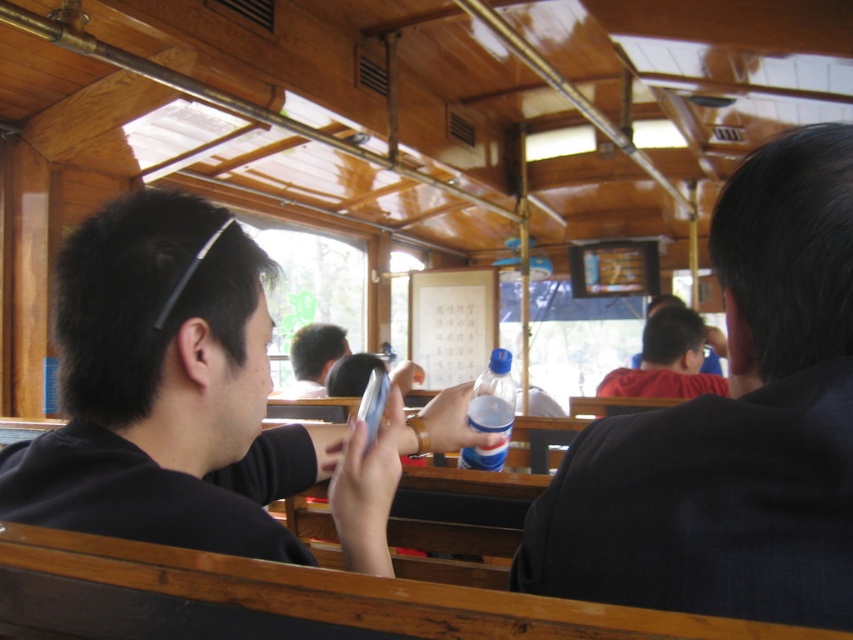
Is dark blue suit at right taller than black matte phone at left?

Yes, dark blue suit at right is taller than black matte phone at left.

Does dark blue suit at right have a smaller size compared to black matte phone at left?

Yes.

Which is in front, point (675, 436) or point (200, 452)?

Positioned in front is point (675, 436).

Locate an element on the screen. dark blue suit at right is located at coordinates (732, 428).